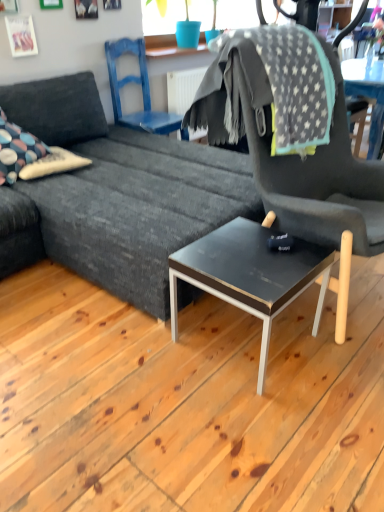
Where is `free space above black glossy coffee table at center (from a real-world perspective)`? The width and height of the screenshot is (384, 512). free space above black glossy coffee table at center (from a real-world perspective) is located at coordinates (251, 250).